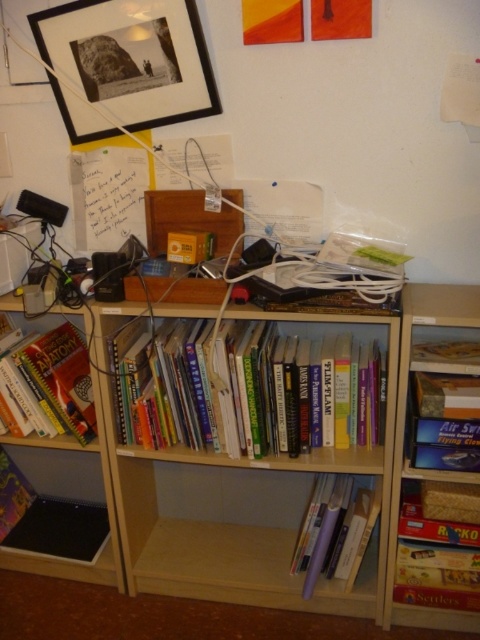
Question: Which of the following is the closest to the observer?

Choices:
 (A) (146, 413)
 (B) (464, 552)
 (C) (62, 61)
 (D) (343, 528)

Answer: (B)

Question: Does blue cardboard game at right have a greater width compared to wooden board game at right?

Choices:
 (A) yes
 (B) no

Answer: (B)

Question: Which object is farther from the camera taking this photo?

Choices:
 (A) hardcover books at center
 (B) wooden board game at lower right
 (C) wooden board game at right
 (D) light wood bookcase at center

Answer: (B)

Question: Is blue cardboard game at right positioned in front of wooden board game at right?

Choices:
 (A) yes
 (B) no

Answer: (B)

Question: Among these objects, which one is farthest from the camera?

Choices:
 (A) blue cardboard game at right
 (B) light wood shelf at lower center
 (C) hardcover books at center

Answer: (B)

Question: Can you confirm if matte black picture frame at upper left is positioned to the left of wooden board game at lower right?

Choices:
 (A) yes
 (B) no

Answer: (A)